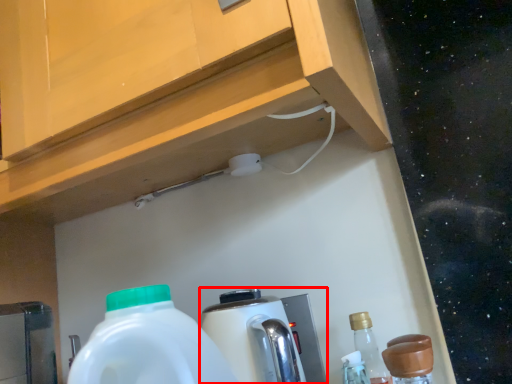
Question: From the image, what is the correct spatial relationship of coffee machine (annotated by the red box) in relation to bottle?

Choices:
 (A) right
 (B) left

Answer: (B)